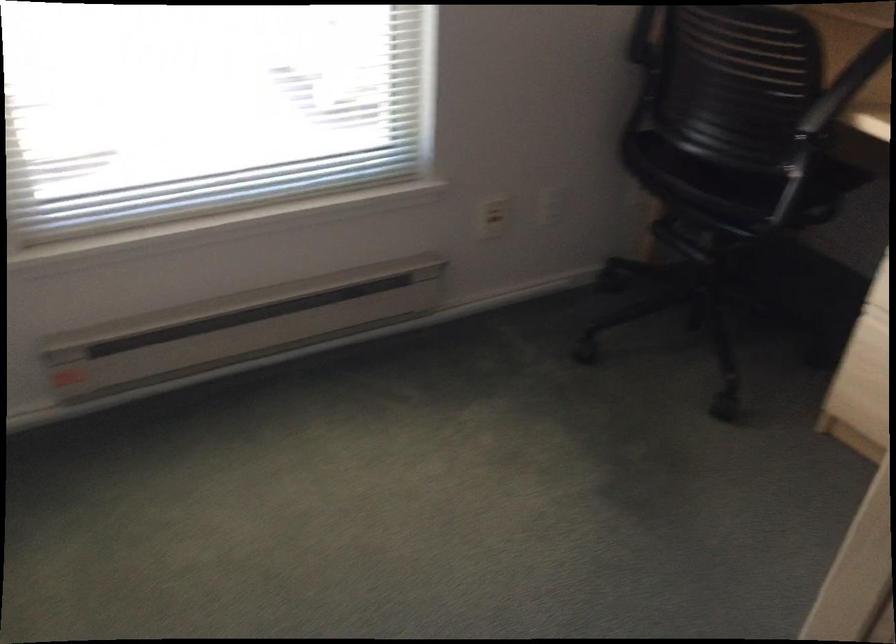
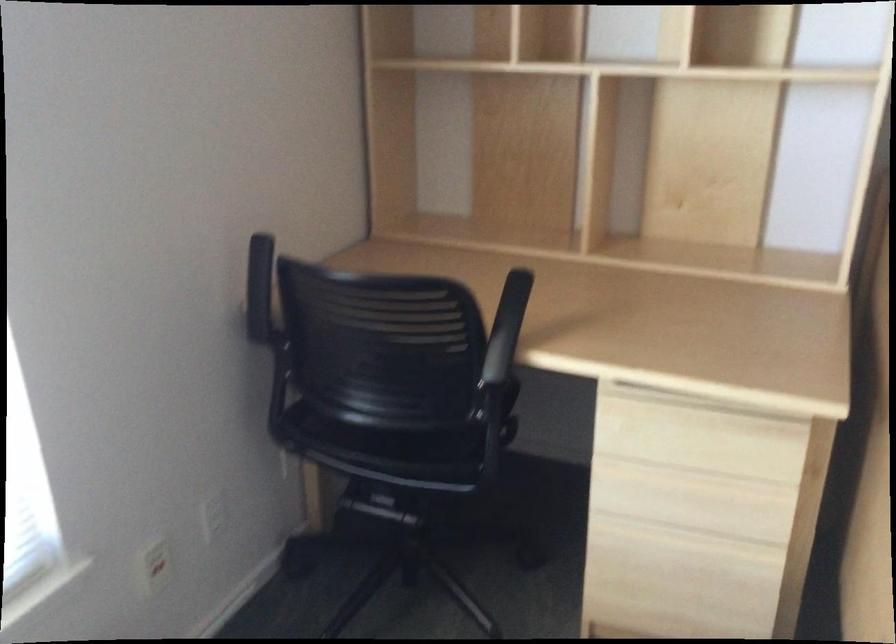
Question: The first image is from the beginning of the video and the second image is from the end. How did the camera likely rotate when shooting the video?

Choices:
 (A) Left
 (B) Right
 (C) Up
 (D) Down

Answer: (B)